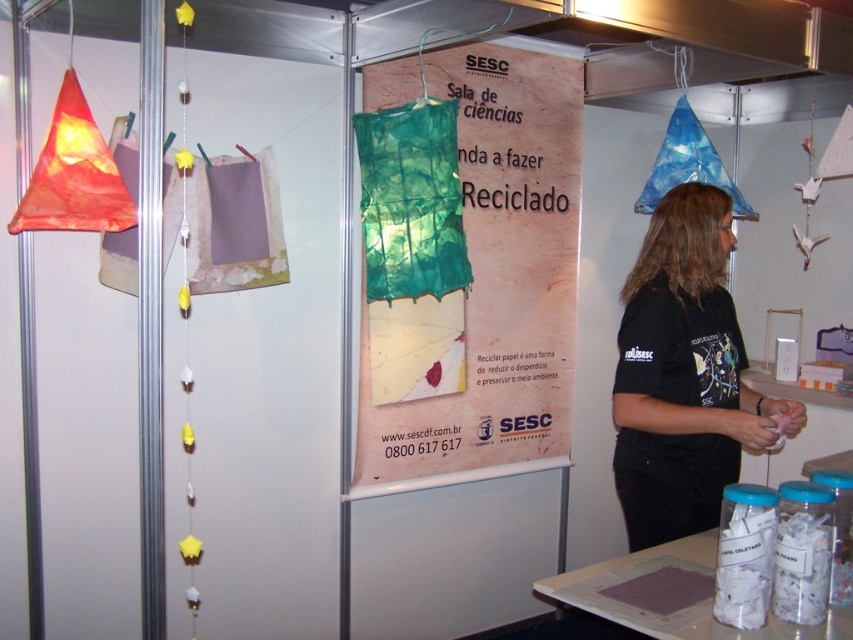
Question: Is green fabric lampshade at center positioned behind black matte shirt at right?

Choices:
 (A) yes
 (B) no

Answer: (A)

Question: Which point is closer to the camera?

Choices:
 (A) green fabric lampshade at center
 (B) black matte shirt at right

Answer: (B)

Question: Is green fabric lampshade at center behind black matte shirt at right?

Choices:
 (A) no
 (B) yes

Answer: (B)

Question: Considering the relative positions of green fabric lampshade at center and black matte shirt at right in the image provided, where is green fabric lampshade at center located with respect to black matte shirt at right?

Choices:
 (A) below
 (B) above

Answer: (B)